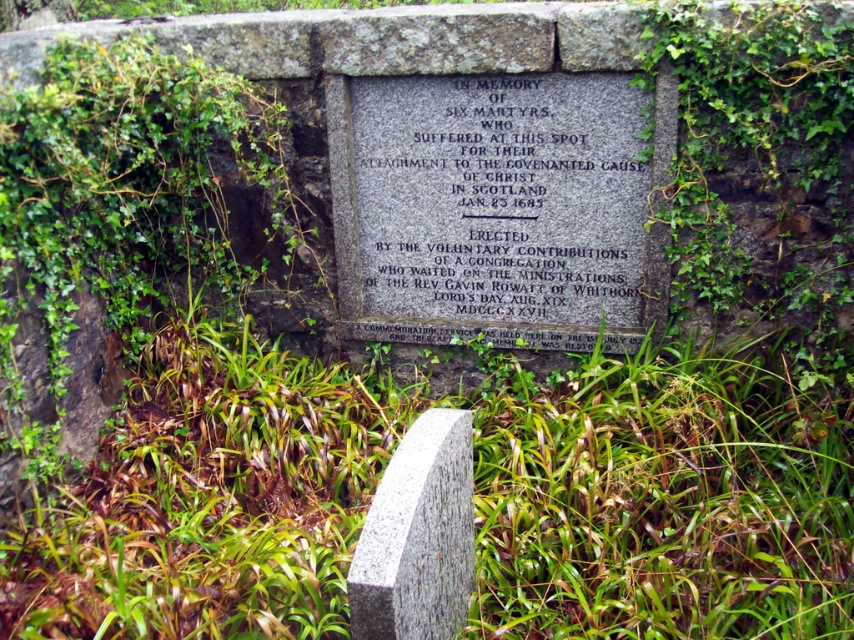
How distant is green grass at center from gray stone plaque at center?

green grass at center is 63.71 centimeters from gray stone plaque at center.

Based on the photo, is green grass at center behind gray stone plaque at center?

No.

Is point (82, 509) behind point (402, 138)?

That is False.

Locate an element on the screen. The width and height of the screenshot is (854, 640). green grass at center is located at coordinates click(x=664, y=499).

Can you confirm if green grass at center is positioned below granite gravestone at center?

Incorrect, green grass at center is not positioned below granite gravestone at center.

Measure the distance between point (4, 598) and camera.

2.17 meters

Image resolution: width=854 pixels, height=640 pixels. What are the coordinates of `green grass at center` in the screenshot? It's located at (664, 499).

The image size is (854, 640). Describe the element at coordinates (500, 196) in the screenshot. I see `gray stone plaque at center` at that location.

Who is taller, gray stone plaque at center or granite gravestone at center?

Standing taller between the two is gray stone plaque at center.

Between point (401, 310) and point (448, 609), which one is positioned in front?

Positioned in front is point (448, 609).

You are a GUI agent. You are given a task and a screenshot of the screen. Output one action in this format:
    pyautogui.click(x=<x>, y=<y>)
    Task: Click on the gray stone plaque at center
    
    Given the screenshot: What is the action you would take?
    pyautogui.click(x=500, y=196)